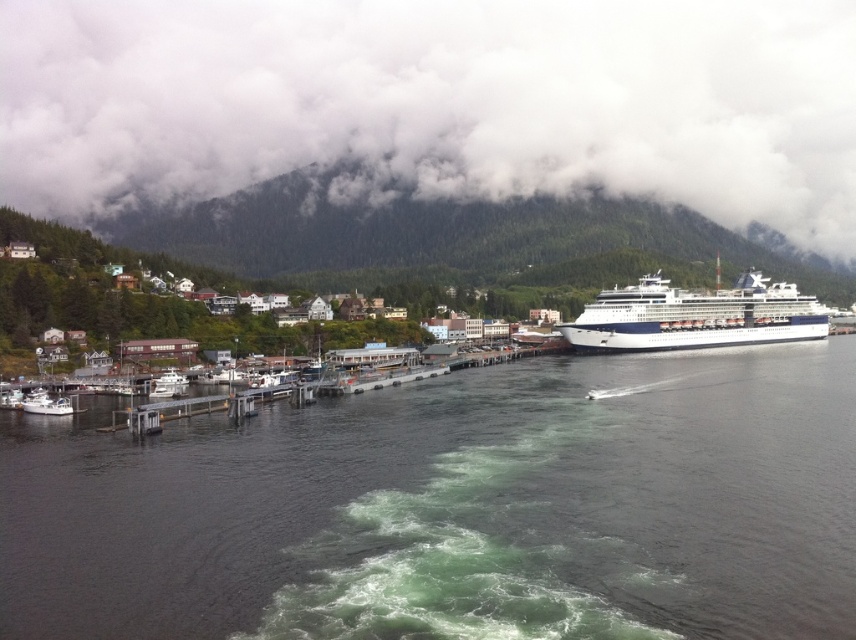
Is green forested mountain at upper center thinner than white matte boat at lower left?

Incorrect, green forested mountain at upper center's width is not less than white matte boat at lower left's.

This screenshot has height=640, width=856. What do you see at coordinates (458, 237) in the screenshot?
I see `green forested mountain at upper center` at bounding box center [458, 237].

Is point (684, 262) closer to viewer compared to point (58, 404)?

No, (684, 262) is further to viewer.

Where is `green forested mountain at upper center`? green forested mountain at upper center is located at coordinates (x=458, y=237).

Can you confirm if green forested mountain at upper center is shorter than wooden houses at left?

In fact, green forested mountain at upper center may be taller than wooden houses at left.

Is point (134, 211) behind point (21, 305)?

Yes, it is behind point (21, 305).

Between point (220, 202) and point (78, 294), which one is positioned behind?

The point (220, 202) is behind.

Find the location of a particular element. This screenshot has width=856, height=640. green forested mountain at upper center is located at coordinates 458,237.

Between white fluffy cloud at upper center and green forested mountain at upper center, which one appears on the right side from the viewer's perspective?

Positioned to the right is green forested mountain at upper center.

Is white fluffy cloud at upper center above green forested mountain at upper center?

Indeed, white fluffy cloud at upper center is positioned over green forested mountain at upper center.

Is point (539, 166) positioned before point (486, 227)?

No, (539, 166) is behind (486, 227).

At what (x,y) coordinates should I click in order to perform the action: click on white fluffy cloud at upper center. Please return your answer as a coordinate pair (x, y). Looking at the image, I should click on (437, 102).